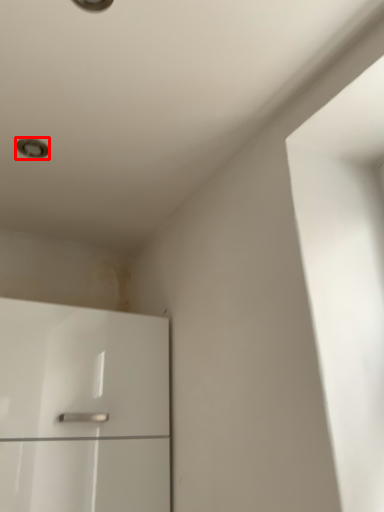
Question: Where is dot (annotated by the red box) located in relation to cabinetry in the image?

Choices:
 (A) right
 (B) left

Answer: (B)